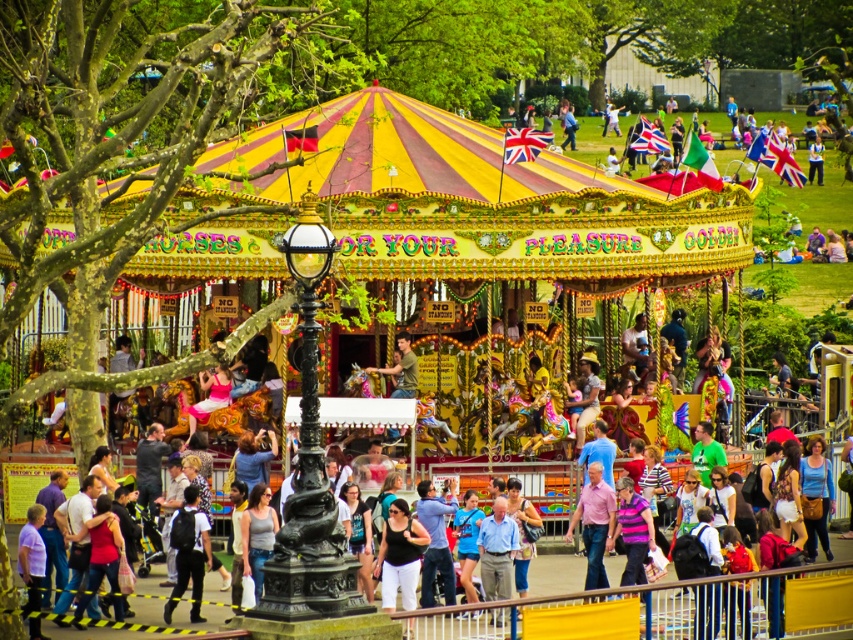
Looking at this image, which is above, dark blue backpack at center or pink cotton shirt at center?

pink cotton shirt at center is above.

Identify the location of dark blue backpack at center. (189, 552).

Identify the location of dark blue backpack at center. The height and width of the screenshot is (640, 853). (189, 552).